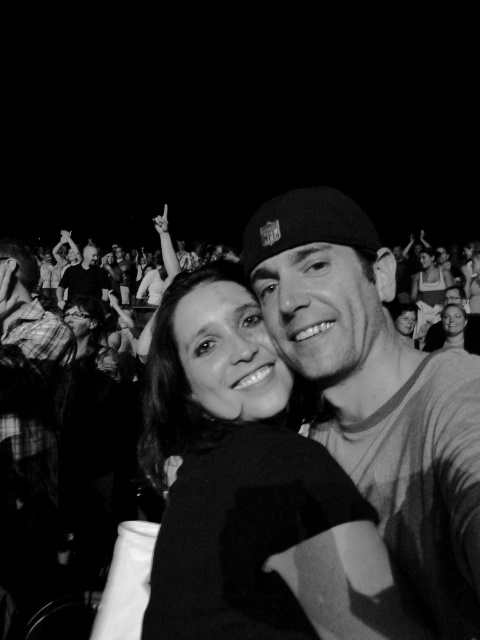
You are a photographer at the event and need to capture a photo of the plaid shirt at left without any obstructions. The camera you are using has a minimum focusing distance of 7 feet. Can you take the photo from your current position?

The plaid shirt at left and camera are 7.24 feet apart. Since the minimum focusing distance is 7 feet, the photographer can take the photo from the current position as the distance is sufficient.

You are a photographer at the event and want to capture a photo of both the matte white tank top at center and the smooth skin man at upper left. Which object should you adjust your camera focus to first if you want to ensure both are in focus?

The matte white tank top at center is to the right of the smooth skin man at upper left, so you should focus on the smooth skin man at upper left first as he is closer to the camera, ensuring both will be in focus when adjusted properly.

In the scene, you are trying to determine which clothing item is narrower between the plaid shirt at left and the matte white tank top at center. Which one should you choose?

The plaid shirt at left has a lesser width compared to matte white tank top at center, so the plaid shirt at left is narrower.